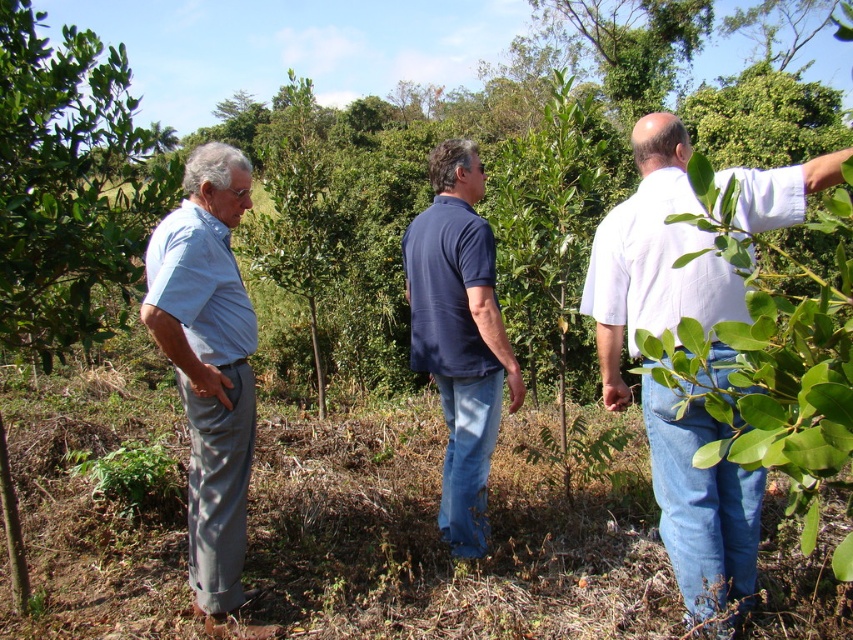
You are planning to take a photo of the navy blue shirt at center and the green leafy tree at left. The camera you have can focus on objects within a 5 meter range. Will both subjects be in focus if they are positioned exactly as shown in the image?

The green leafy tree at left is 5.52 meters from the navy blue shirt at center. Since the camera can only focus within 5 meters, the distance between them exceeds the focus range. Therefore, both subjects cannot be in focus simultaneously.